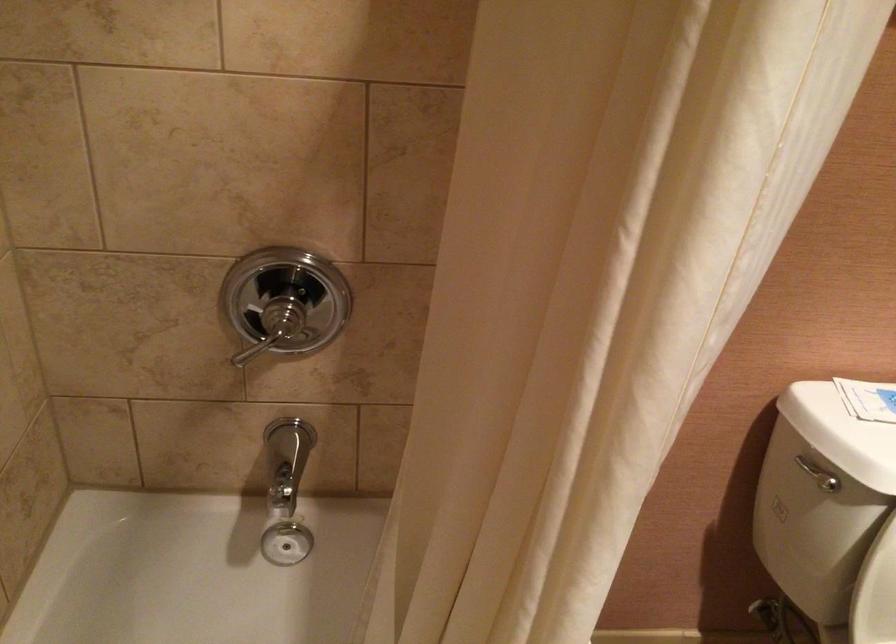
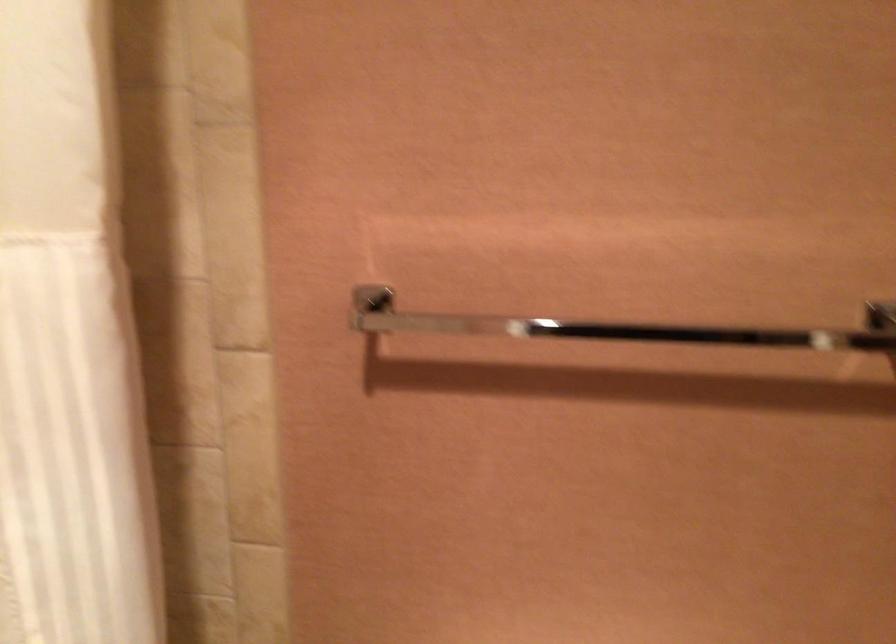
Question: In a continuous first-person perspective shot, in which direction is the camera moving?

Choices:
 (A) Left
 (B) Right
 (C) Forward
 (D) Backward

Answer: (B)